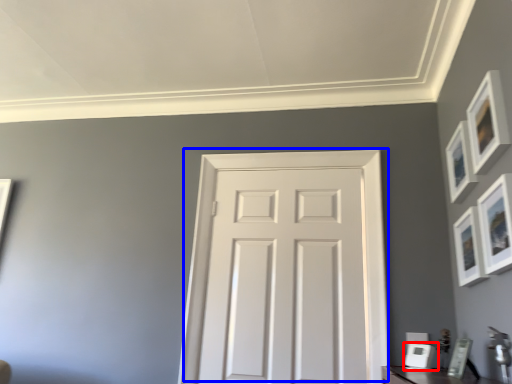
Question: Which of the following is the closest to the observer, picture frame (highlighted by a red box) or door (highlighted by a blue box)?

Choices:
 (A) picture frame
 (B) door

Answer: (A)